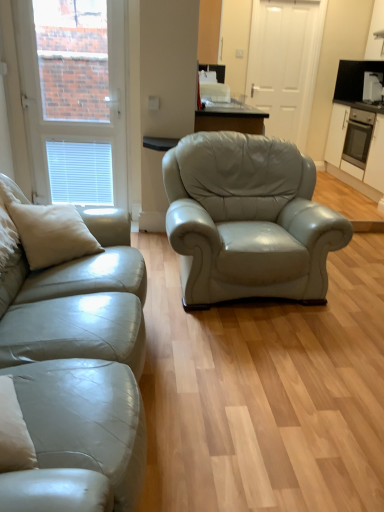
Question: Does white matte door at center have a smaller size compared to beige leather pillow at left?

Choices:
 (A) no
 (B) yes

Answer: (B)

Question: Can you confirm if white matte door at center is positioned to the right of beige leather pillow at left?

Choices:
 (A) yes
 (B) no

Answer: (A)

Question: Is white matte door at center with beige leather pillow at left?

Choices:
 (A) yes
 (B) no

Answer: (B)

Question: Is white matte door at center thinner than beige leather pillow at left?

Choices:
 (A) no
 (B) yes

Answer: (B)

Question: Is white matte door at center not near beige leather pillow at left?

Choices:
 (A) no
 (B) yes

Answer: (B)

Question: Is beige leather pillow at left at the back of white matte door at center?

Choices:
 (A) yes
 (B) no

Answer: (B)

Question: From the image's perspective, is white matte cabinet at right on top of white matte door at center?

Choices:
 (A) no
 (B) yes

Answer: (A)

Question: Is white matte cabinet at right positioned behind white matte door at center?

Choices:
 (A) no
 (B) yes

Answer: (B)

Question: Is white matte cabinet at right outside white matte door at center?

Choices:
 (A) no
 (B) yes

Answer: (B)

Question: Is white matte door at center located within white matte cabinet at right?

Choices:
 (A) no
 (B) yes

Answer: (A)

Question: From the image's perspective, is white matte cabinet at right under white matte door at center?

Choices:
 (A) no
 (B) yes

Answer: (B)

Question: Can you see white matte cabinet at right touching white matte door at center?

Choices:
 (A) no
 (B) yes

Answer: (A)

Question: Considering the relative sizes of white glossy toaster at upper right and white matte window at upper left in the image provided, is white glossy toaster at upper right smaller than white matte window at upper left?

Choices:
 (A) no
 (B) yes

Answer: (B)